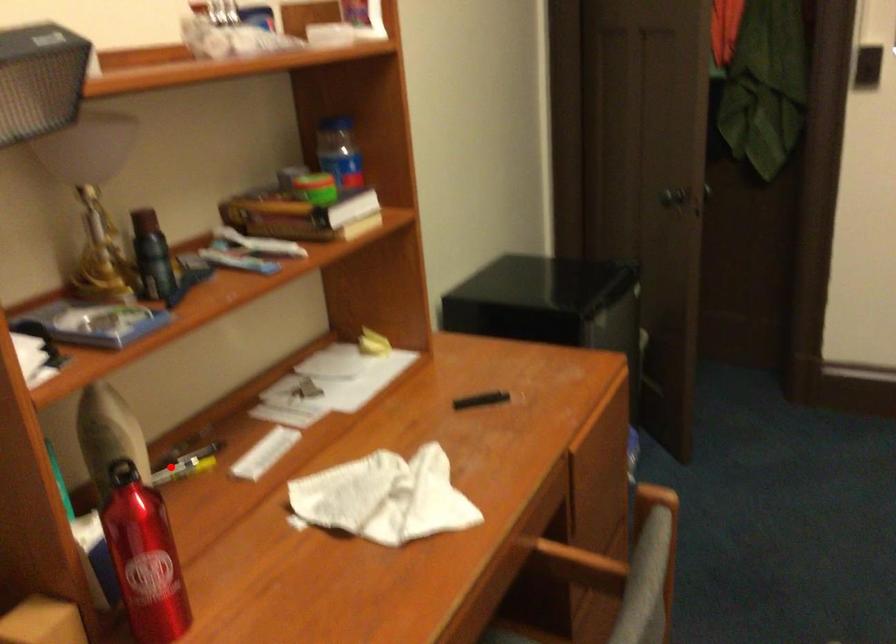
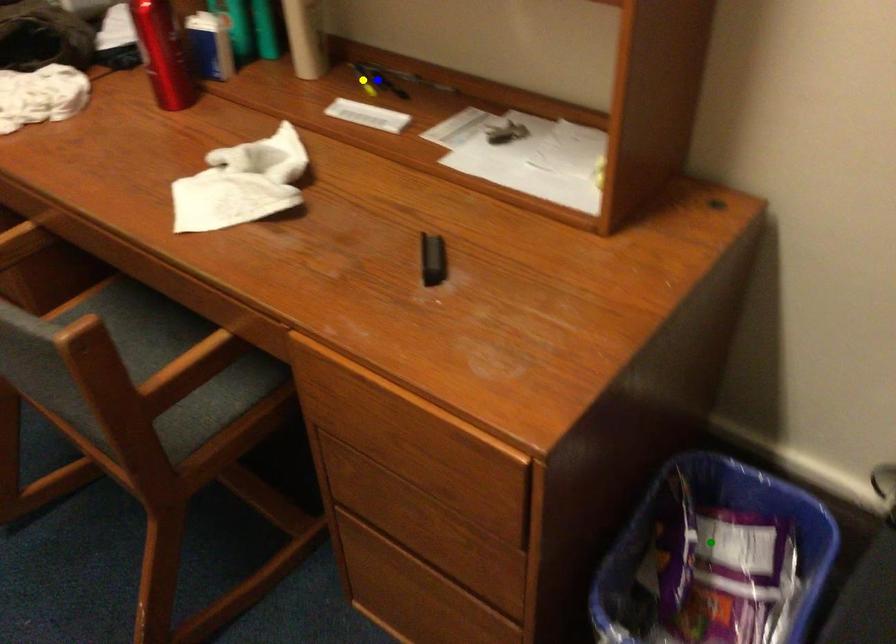
Question: I am providing you with two images of the same scene from different viewpoints. A red point is marked on the first image. You are given multiple points on the second image. Which mark in image 2 goes with the point in image 1?

Choices:
 (A) green point
 (B) yellow point
 (C) blue point

Answer: (C)